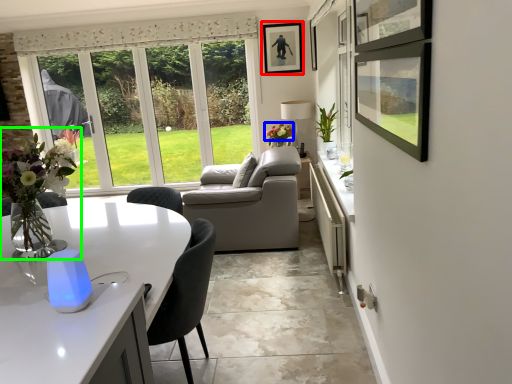
Question: Which is nearer to the picture frame (highlighted by a red box)? flower (highlighted by a blue box) or floral arrangement (highlighted by a green box).

Choices:
 (A) flower
 (B) floral arrangement

Answer: (A)